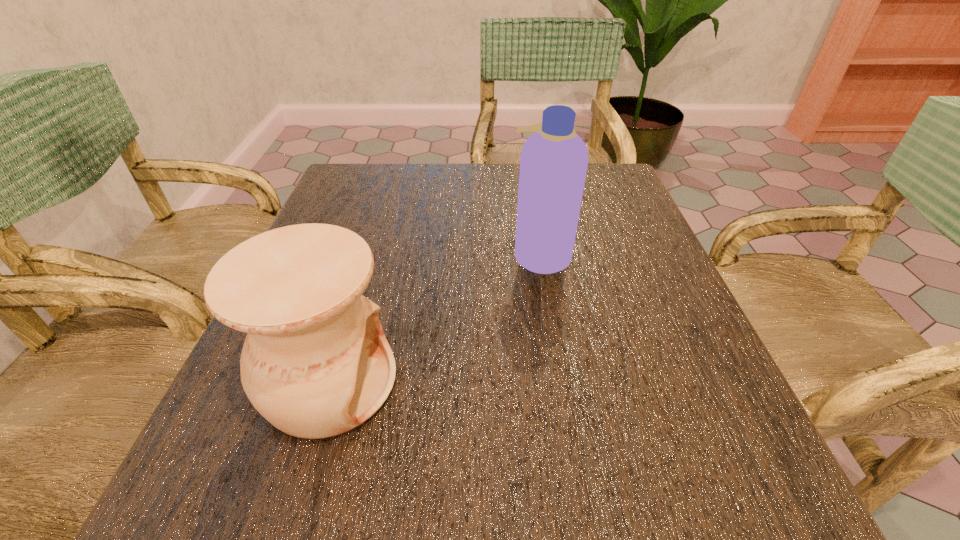
Where is `shampoo`? This screenshot has width=960, height=540. shampoo is located at coordinates (553, 164).

You are a GUI agent. You are given a task and a screenshot of the screen. Output one action in this format:
    pyautogui.click(x=<x>, y=<y>)
    Task: Click on the right object
    The width and height of the screenshot is (960, 540).
    Given the screenshot: What is the action you would take?
    pyautogui.click(x=553, y=164)

This screenshot has width=960, height=540. What are the coordinates of `the left object` in the screenshot? It's located at (315, 363).

The height and width of the screenshot is (540, 960). What are the coordinates of `the shorter object` in the screenshot? It's located at (315, 363).

Image resolution: width=960 pixels, height=540 pixels. In order to click on free space located on the left of the right object in this screenshot , I will do `click(316, 254)`.

At what (x,y) coordinates should I click in order to perform the action: click on vacant area situated 0.150m at the open side of the shorter object. Please return your answer as a coordinate pair (x, y). This screenshot has width=960, height=540. Looking at the image, I should click on (495, 382).

At what (x,y) coordinates should I click in order to perform the action: click on object present at the left edge. Please return your answer as a coordinate pair (x, y). Looking at the image, I should click on (315, 363).

Find the location of a particular element. The height and width of the screenshot is (540, 960). vacant space at the far edge of the desktop is located at coordinates (458, 178).

Locate an element on the screen. vacant space at the near edge of the desktop is located at coordinates (396, 462).

Image resolution: width=960 pixels, height=540 pixels. In order to click on vacant space at the right edge of the desktop in this screenshot , I will do `click(630, 319)`.